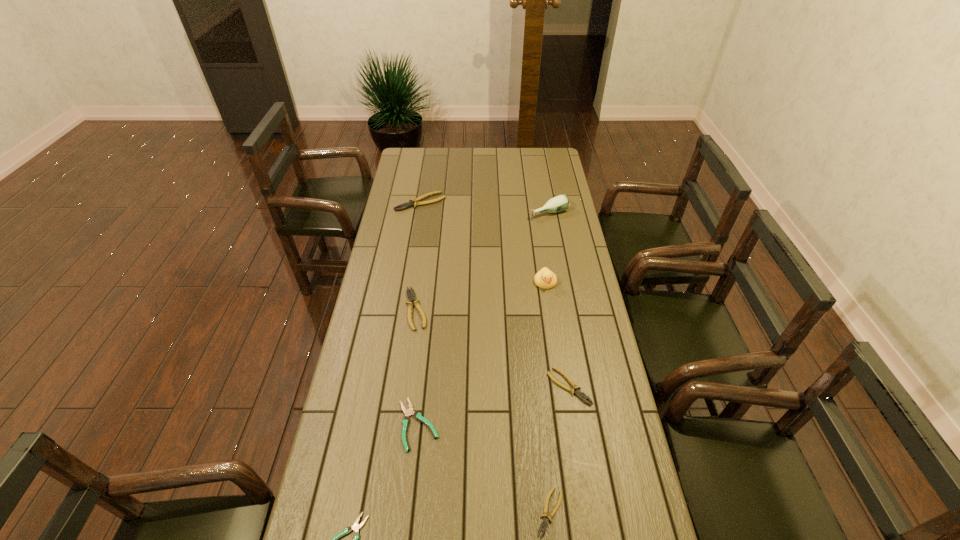
Where is `the nearest yellow pliers`? the nearest yellow pliers is located at coordinates (545, 522).

Find the location of a particular element. free space located 0.150m on the back of the bottle is located at coordinates (543, 186).

Locate an element on the screen. Image resolution: width=960 pixels, height=540 pixels. vacant area situated 0.060m on the face of the duckling is located at coordinates (548, 303).

You are a GUI agent. You are given a task and a screenshot of the screen. Output one action in this format:
    pyautogui.click(x=<x>, y=<y>)
    Task: Click on the free space located 0.250m on the back of the biggest yellow pliers
    Image resolution: width=960 pixels, height=540 pixels.
    Given the screenshot: What is the action you would take?
    pyautogui.click(x=426, y=166)

Find the location of a particular element. The image size is (960, 540). free space located on the right of the second tallest pliers is located at coordinates (464, 309).

This screenshot has height=540, width=960. Identify the location of vacant space located 0.210m on the front of the third tallest pliers. (584, 477).

The width and height of the screenshot is (960, 540). Identify the location of free space located 0.100m on the left of the farther teal pliers. (363, 425).

Find the location of a particular element. Image resolution: width=960 pixels, height=540 pixels. vacant space located 0.140m on the right of the smallest yellow pliers is located at coordinates (619, 512).

This screenshot has height=540, width=960. What are the coordinates of `bottle positioned at the right edge` in the screenshot? It's located at (559, 203).

Identify the location of duckling present at the right edge. The image size is (960, 540). (545, 279).